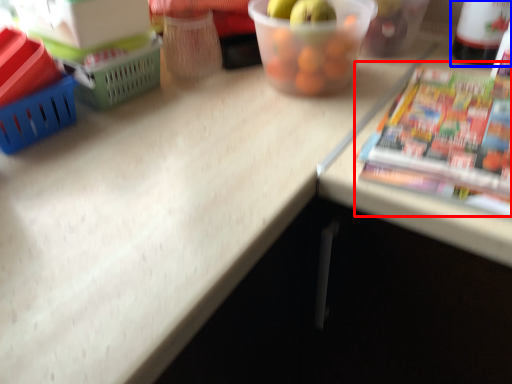
Question: Among these objects, which one is nearest to the camera, paperback book (highlighted by a red box) or bottle (highlighted by a blue box)?

Choices:
 (A) paperback book
 (B) bottle

Answer: (A)